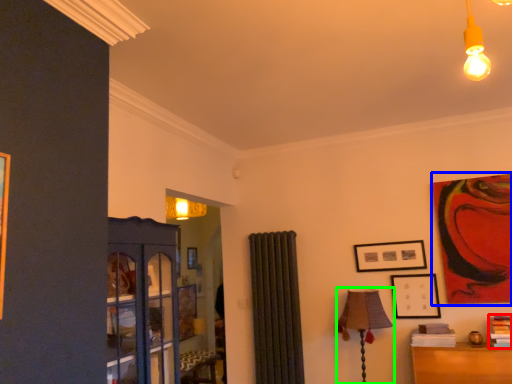
Question: Based on their relative distances, which object is farther from book (highlighted by a red box)? Choose from picture frame (highlighted by a blue box) and table lamp (highlighted by a green box).

Choices:
 (A) picture frame
 (B) table lamp

Answer: (B)